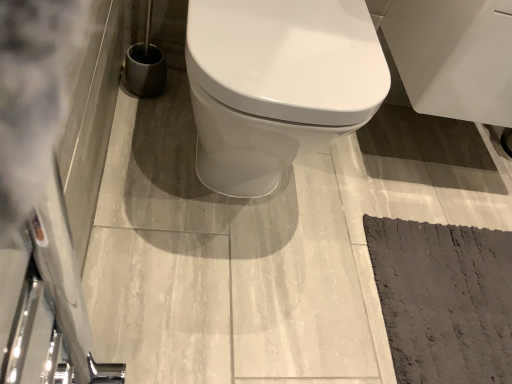
Locate an element on the screen. free space above dark gray textured mat at lower right (from a real-world perspective) is located at coordinates (459, 293).